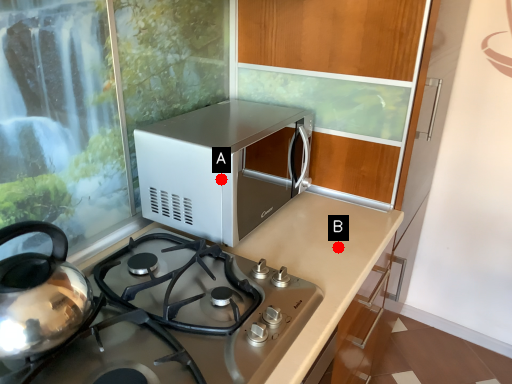
Question: Two points are circled on the image, labeled by A and B beside each circle. Which point appears farthest from the camera in this image?

Choices:
 (A) A is further
 (B) B is further

Answer: (B)